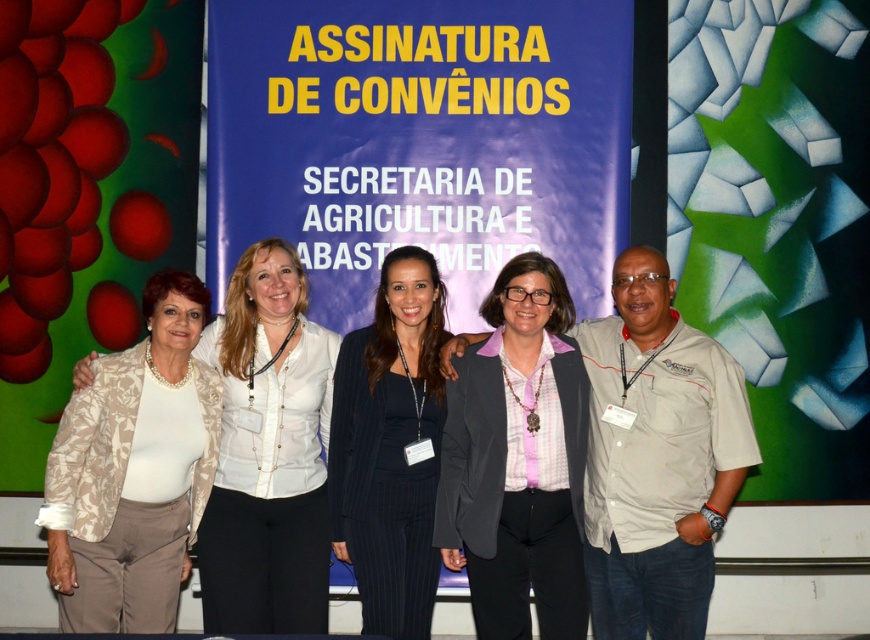
Question: Does pink fabric at center have a lesser width compared to black pinstripe suit at center?

Choices:
 (A) yes
 (B) no

Answer: (B)

Question: Based on their relative distances, which object is farther from the black pinstripe suit at center?

Choices:
 (A) pink fabric shirt at center
 (B) pink fabric at center
 (C) beige floral blazer at left
 (D) beige textured blazer at left

Answer: (B)

Question: Is pink fabric shirt at center positioned before black pinstripe suit at center?

Choices:
 (A) yes
 (B) no

Answer: (B)

Question: Which point is closer to the camera?

Choices:
 (A) black pinstripe suit at center
 (B) pink fabric at center
 (C) beige floral blazer at left
 (D) beige textured blazer at left

Answer: (C)

Question: Which object is closer to the camera taking this photo?

Choices:
 (A) pink fabric shirt at center
 (B) beige floral blazer at left
 (C) black pinstripe suit at center

Answer: (B)

Question: Can you confirm if beige textured blazer at left is bigger than black pinstripe suit at center?

Choices:
 (A) no
 (B) yes

Answer: (A)